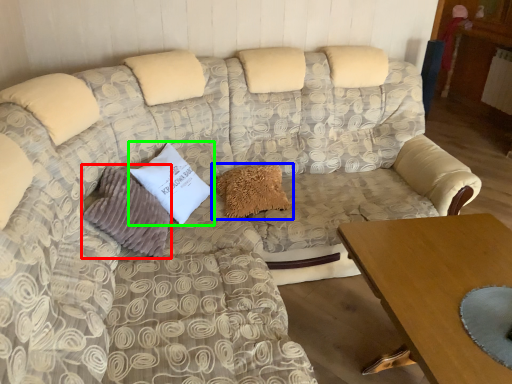
Question: Which object is the farthest from pillow (highlighted by a red box)? Choose among these: pillow (highlighted by a blue box) or pillow (highlighted by a green box).

Choices:
 (A) pillow
 (B) pillow

Answer: (A)